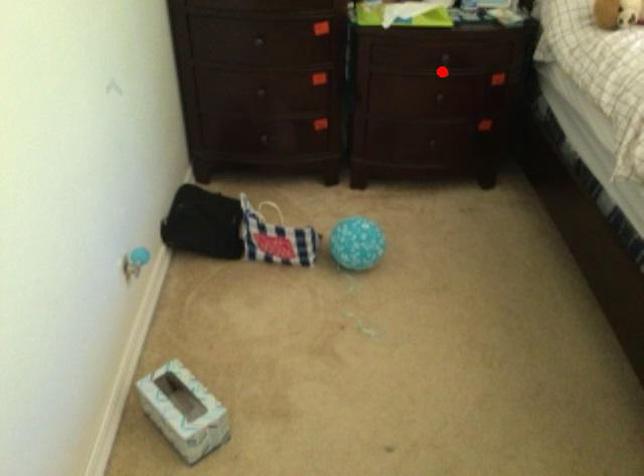
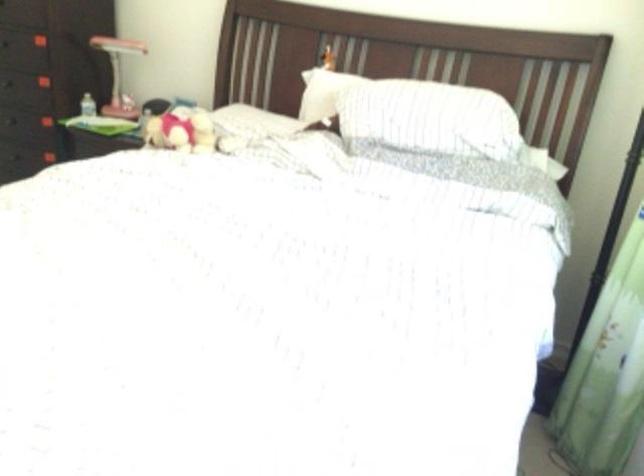
Question: I am providing you with two images of the same scene from different viewpoints. A red point is marked on the first image. Is the red point's position out of view in image 2?

Choices:
 (A) Yes
 (B) No

Answer: (A)